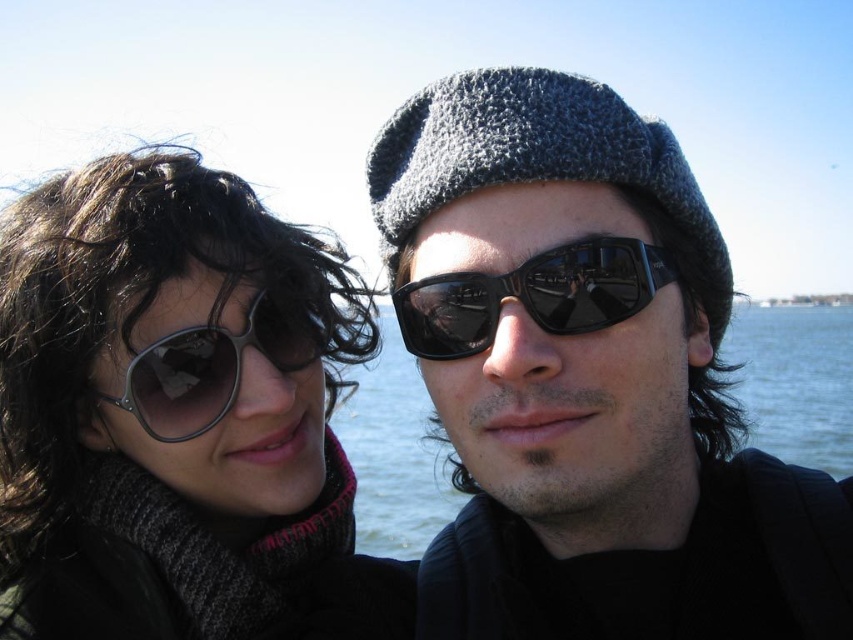
You are taking a selfie with two friends. You notice the blue water at center and the metallic reflective sunglasses at left. Which object is positioned lower in the image?

The blue water at center is positioned lower than the metallic reflective sunglasses at left.

Looking at this image, you are taking a photo of the two people in the scene. The matte black sunglasses at left and the gray knitted beanie at center are both in the frame. Which object is positioned lower in the image?

The matte black sunglasses at left is positioned below the gray knitted beanie at center, so it is lower in the image.

You are trying to locate the matte black sunglasses at left in the image. Where exactly should you look?

You should look at point (178, 417) to find the matte black sunglasses at left.